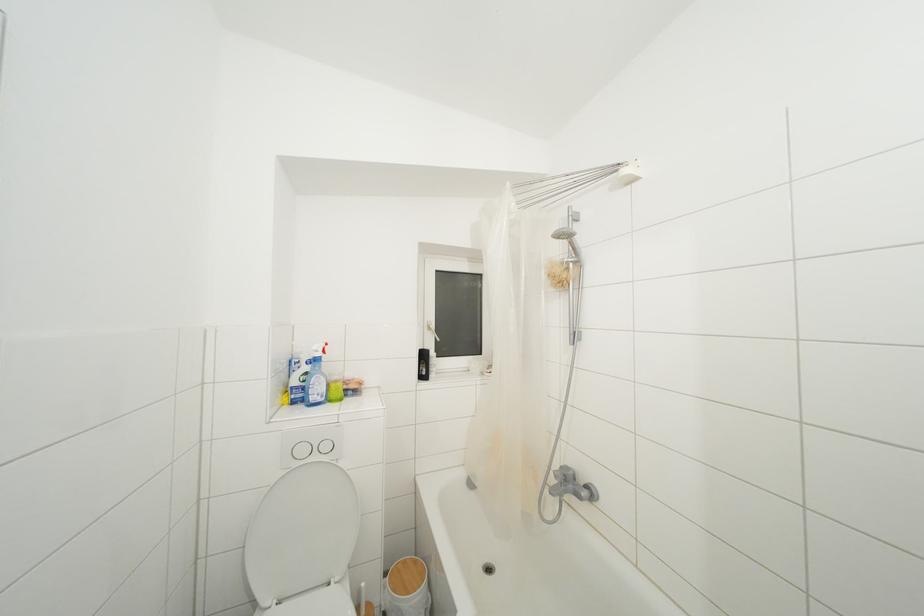
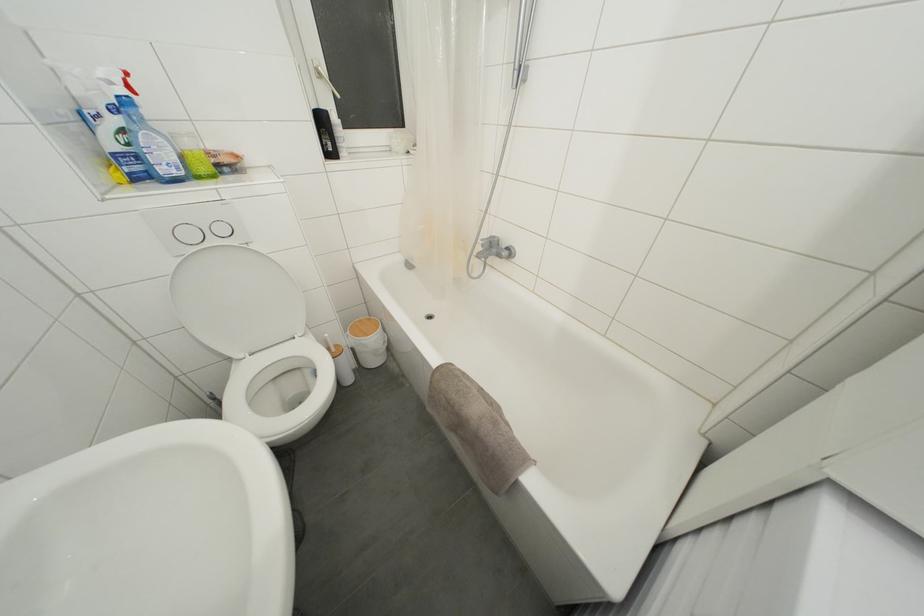
In the second image, find the point that corresponds to [433,333] in the first image.

(323, 79)